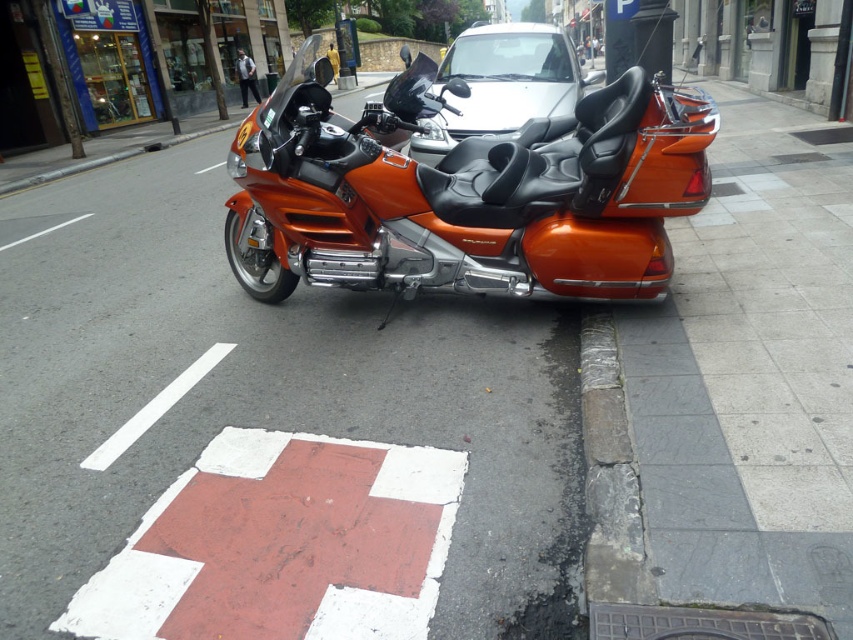
Is orange metallic motorcycle at center positioned before stone at lower center?

No, orange metallic motorcycle at center is behind stone at lower center.

Is orange metallic motorcycle at center smaller than stone at lower center?

Actually, orange metallic motorcycle at center might be larger than stone at lower center.

Which is in front, point (577, 256) or point (592, 317)?

Positioned in front is point (577, 256).

Identify the location of orange metallic motorcycle at center. (463, 192).

Is glossy silver car at center to the left of stone at lower center from the viewer's perspective?

Yes, glossy silver car at center is to the left of stone at lower center.

Which is behind, point (589, 80) or point (598, 488)?

The point (589, 80) is more distant.

Who is more forward, (x=476, y=60) or (x=608, y=376)?

Point (x=608, y=376) is more forward.

At what (x,y) coordinates should I click in order to perform the action: click on glossy silver car at center. Please return your answer as a coordinate pair (x, y). This screenshot has width=853, height=640. Looking at the image, I should click on click(494, 86).

Is orange metallic motorcycle at center positioned before glossy silver car at center?

Yes, it is.

Does orange metallic motorcycle at center have a greater height compared to glossy silver car at center?

Incorrect, orange metallic motorcycle at center's height is not larger of glossy silver car at center's.

The image size is (853, 640). What are the coordinates of `orange metallic motorcycle at center` in the screenshot? It's located at (463, 192).